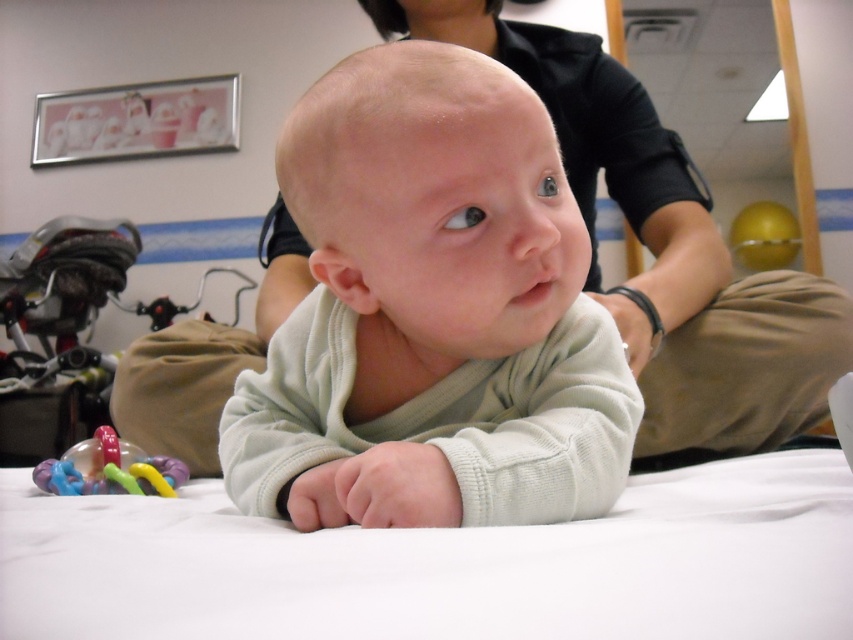
You are a caregiver in a nursery and need to place two babies in the image so that they can see each other clearly. The minimum distance required for them to see each other is 50 centimeters. Based on the current positions of the light green fleece baby at center and the white soft baby at center, can they see each other?

The light green fleece baby at center and the white soft baby at center are 48.67 centimeters apart from each other. Since this distance is less than the required 50 centimeters, they cannot see each other clearly.